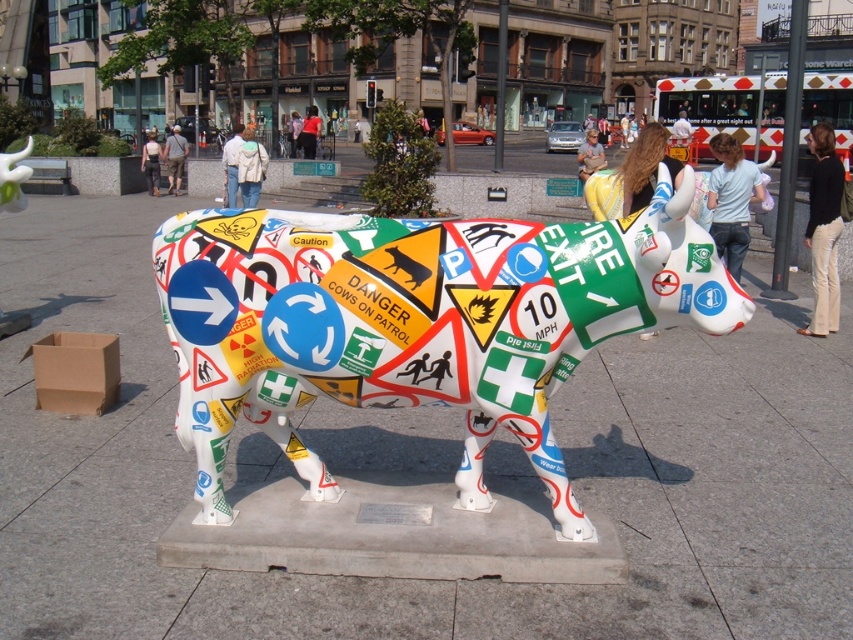
Can you confirm if light beige pants at center right is thinner than denim jeans at center?

Indeed, light beige pants at center right has a lesser width compared to denim jeans at center.

Between light beige pants at center right and denim jeans at center, which one has less height?

light beige pants at center right

Who is more forward, (x=833, y=161) or (x=154, y=184)?

Point (x=833, y=161)

Image resolution: width=853 pixels, height=640 pixels. What are the coordinates of `light beige pants at center right` in the screenshot? It's located at (822, 228).

Does light blue denim jeans at center right have a greater height compared to light beige jacket at center?

Yes.

Does light blue denim jeans at center right appear on the left side of light beige jacket at center?

No, light blue denim jeans at center right is not to the left of light beige jacket at center.

Which is behind, point (741, 237) or point (250, 150)?

Point (250, 150)

Where is `light blue denim jeans at center right`? light blue denim jeans at center right is located at coordinates (730, 198).

How distant is light blue denim jeans at center right from denim jeans at center?

The distance of light blue denim jeans at center right from denim jeans at center is 14.93 meters.

From the picture: Does light blue denim jeans at center right appear on the left side of denim jeans at center?

In fact, light blue denim jeans at center right is to the right of denim jeans at center.

Does point (724, 211) lie behind point (160, 173)?

No, it is in front of (160, 173).

The image size is (853, 640). Find the location of `light blue denim jeans at center right`. light blue denim jeans at center right is located at coordinates (730, 198).